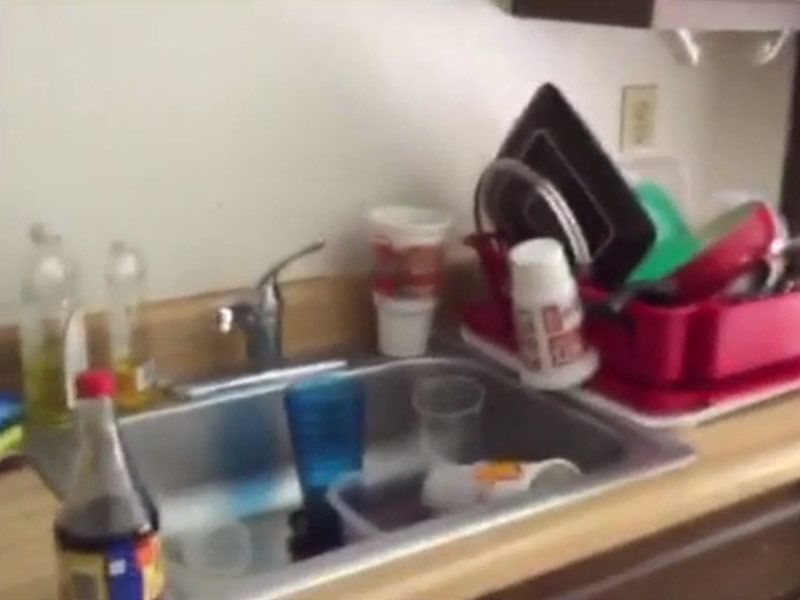
The width and height of the screenshot is (800, 600). Identify the location of sink spout. (226, 319).